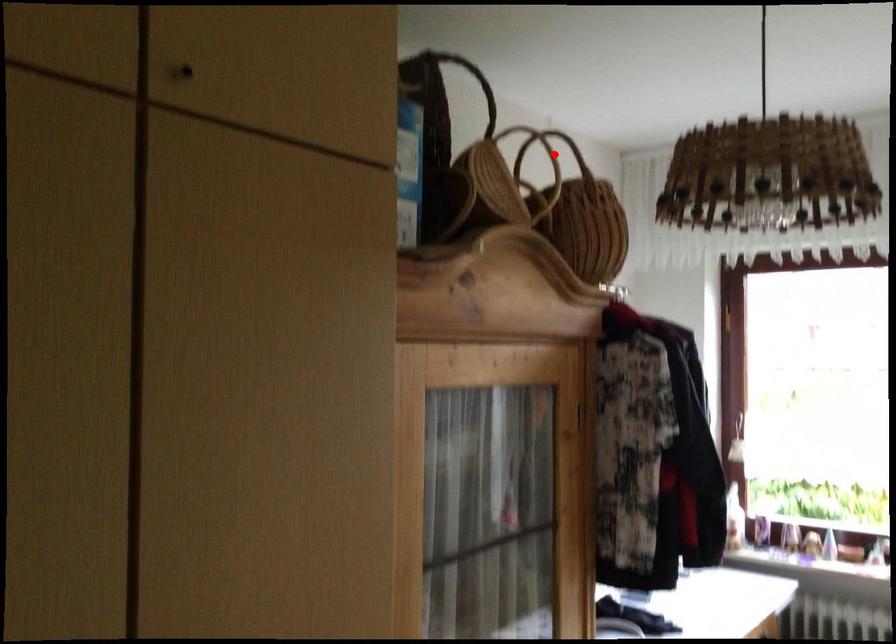
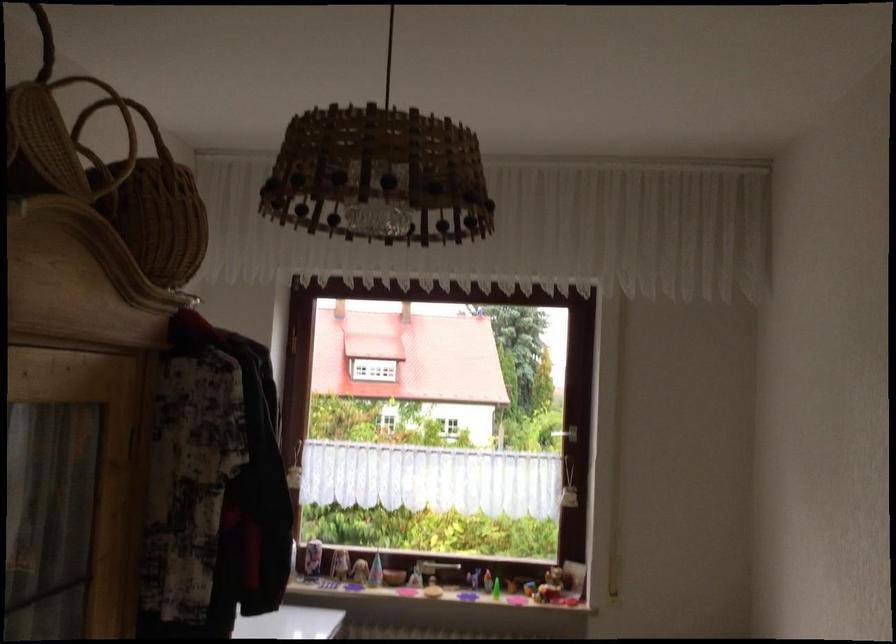
Question: I am providing you with two images of the same scene from different viewpoints. A red point is shown in image1. For the corresponding object point in image2, is it positioned nearer or farther from the camera?

Choices:
 (A) Nearer
 (B) Farther

Answer: (B)